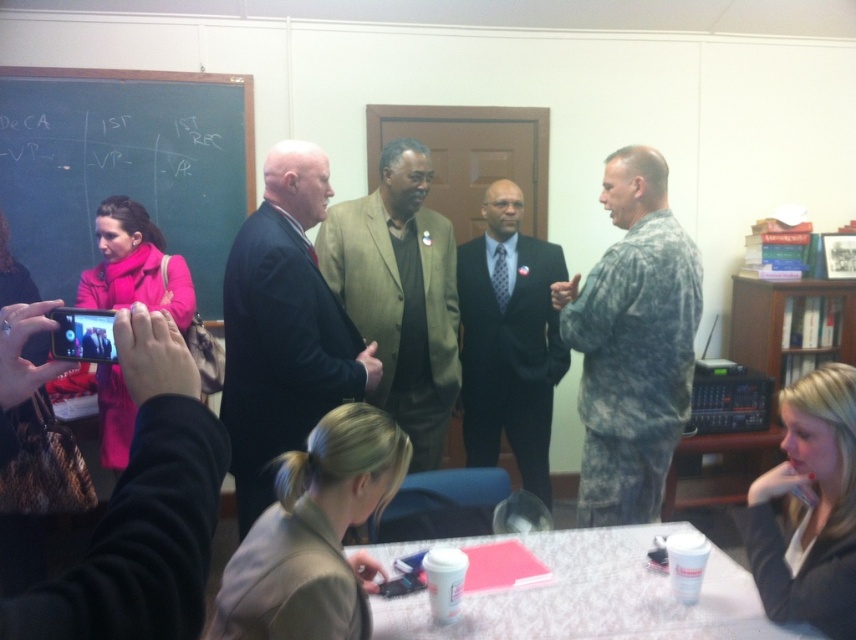
You are attending a meeting in a classroom. You see a camouflage uniform at right and a dark suit at center. Which person is standing more to the right side?

The camouflage uniform at right is more to the right side than the dark suit at center.

You are a student sitting at the table with the white tablecloth. You need to hand a document to the man in the camouflage uniform at right. Which direction should you walk to reach him?

The camouflage uniform at right is located at point (x=632, y=342), so you should walk towards the right side of the image to reach him.